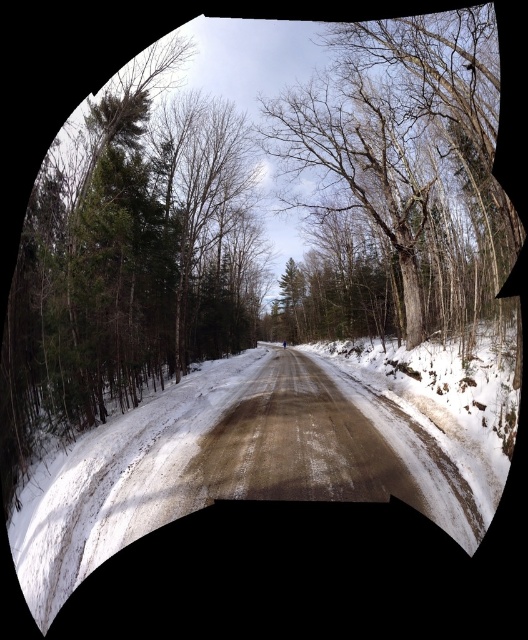
Question: Among these objects, which one is farthest from the camera?

Choices:
 (A) bare wood tree at center
 (B) white powdery snow at center

Answer: (A)

Question: Can you confirm if white powdery snow at center is smaller than bare wood tree at center?

Choices:
 (A) yes
 (B) no

Answer: (A)

Question: Which point appears farthest from the camera in this image?

Choices:
 (A) (457, 467)
 (B) (456, 97)

Answer: (B)

Question: Which object appears closest to the camera in this image?

Choices:
 (A) bare wood tree at center
 (B) white powdery snow at center

Answer: (B)

Question: In this image, where is white powdery snow at center located relative to bare wood tree at center?

Choices:
 (A) right
 (B) left

Answer: (B)

Question: Does white powdery snow at center appear on the left side of bare wood tree at center?

Choices:
 (A) no
 (B) yes

Answer: (B)